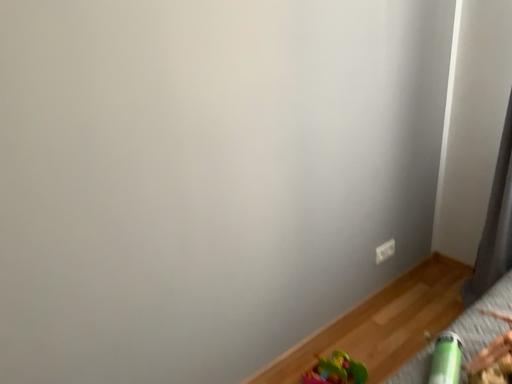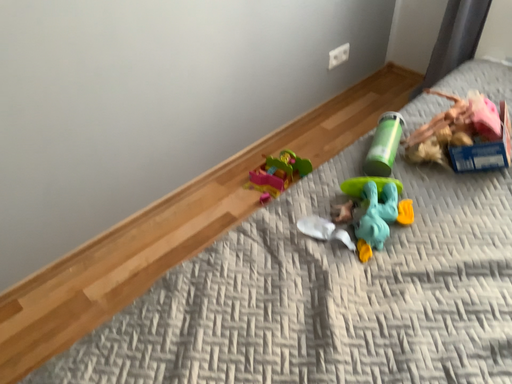
Question: Which way did the camera rotate in the video?

Choices:
 (A) rotated downward
 (B) rotated upward

Answer: (A)